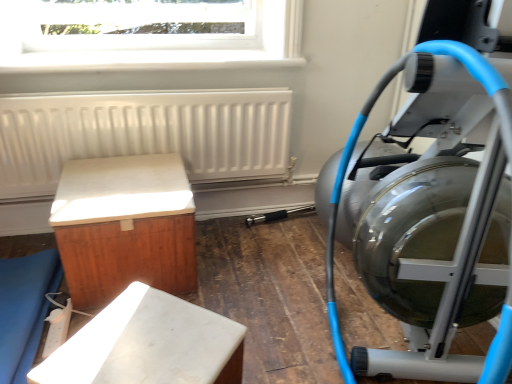
Where is `vacant space situated above white matte cabinet at left, which ranks as the 2th furniture in right-to-left order (from a real-world perspective)`? vacant space situated above white matte cabinet at left, which ranks as the 2th furniture in right-to-left order (from a real-world perspective) is located at coordinates (114, 184).